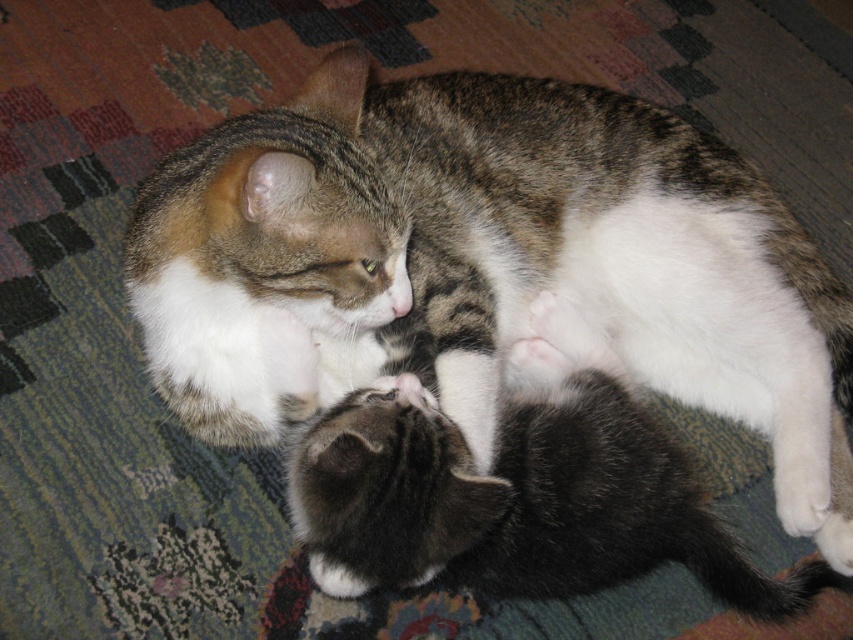
Question: Which of the following is the closest to the observer?

Choices:
 (A) (555, 224)
 (B) (705, 525)

Answer: (B)

Question: Does tabby fur cat at center appear under soft gray fur kitten at lower center?

Choices:
 (A) no
 (B) yes

Answer: (A)

Question: Does tabby fur cat at center have a lesser width compared to soft gray fur kitten at lower center?

Choices:
 (A) no
 (B) yes

Answer: (A)

Question: Which object appears farthest from the camera in this image?

Choices:
 (A) soft gray fur kitten at lower center
 (B) tabby fur cat at center

Answer: (A)

Question: Is tabby fur cat at center below soft gray fur kitten at lower center?

Choices:
 (A) no
 (B) yes

Answer: (A)

Question: Which object appears closest to the camera in this image?

Choices:
 (A) soft gray fur kitten at lower center
 (B) tabby fur cat at center

Answer: (B)